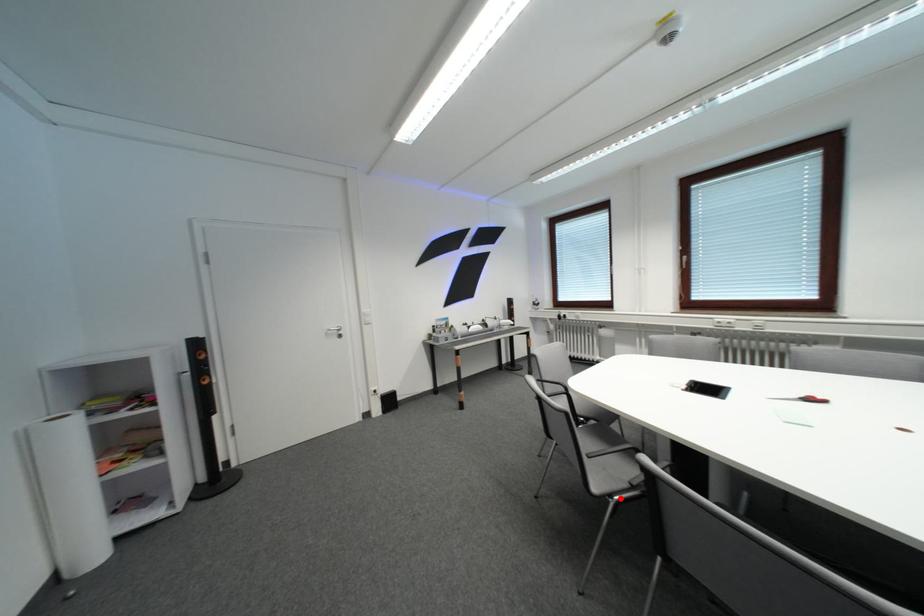
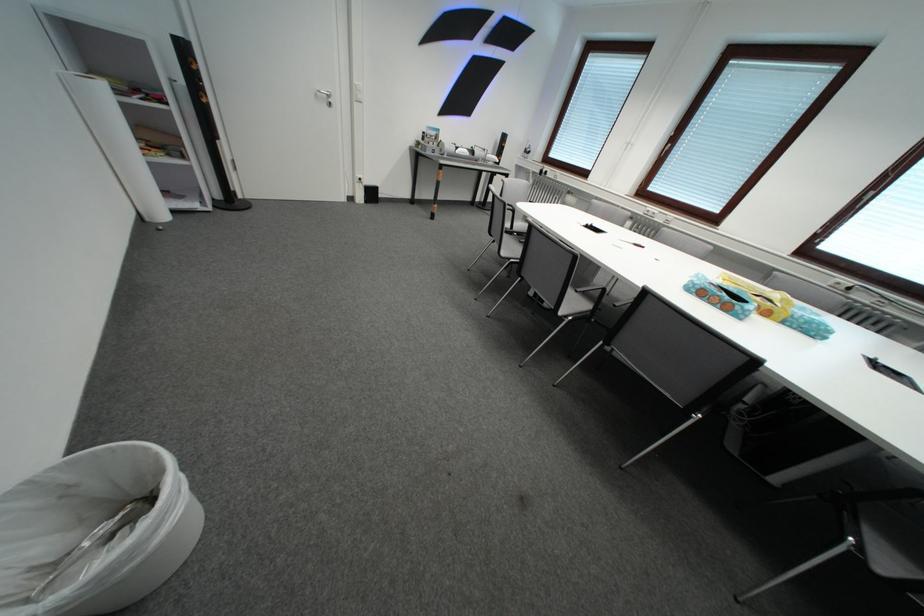
Find the pixel in the second image that matches the highlighted location in the first image.

(519, 262)